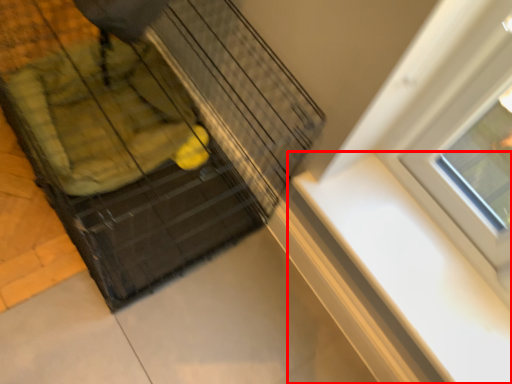
Question: Where is window sill (annotated by the red box) located in relation to baby carriage in the image?

Choices:
 (A) left
 (B) right

Answer: (B)